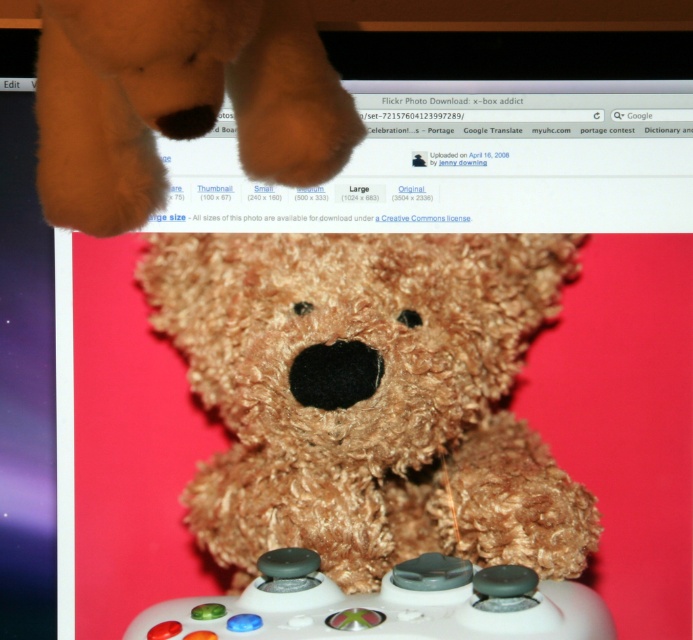
You are trying to decide which item to place on a small shelf that can only hold one of them. Based on their sizes, which item from the fuzzy brown teddy bear at center and the white matte game controller at center would you choose to fit on the shelf?

The white matte game controller at center is shorter than the fuzzy brown teddy bear at center, so the white matte game controller at center would fit better on the small shelf.

You are holding a 12 inch ruler and want to measure the distance between yourself and the fuzzy brown teddy bear at center. According to the ruler, how many rulers would you need to stack end to end to reach that distance?

The fuzzy brown teddy bear at center and viewer are 36.42 inches apart. Since each ruler is 12 inches long, you would need 3 rulers stacked end to end to cover the distance because 36.42 divided by 12 is approximately 3.